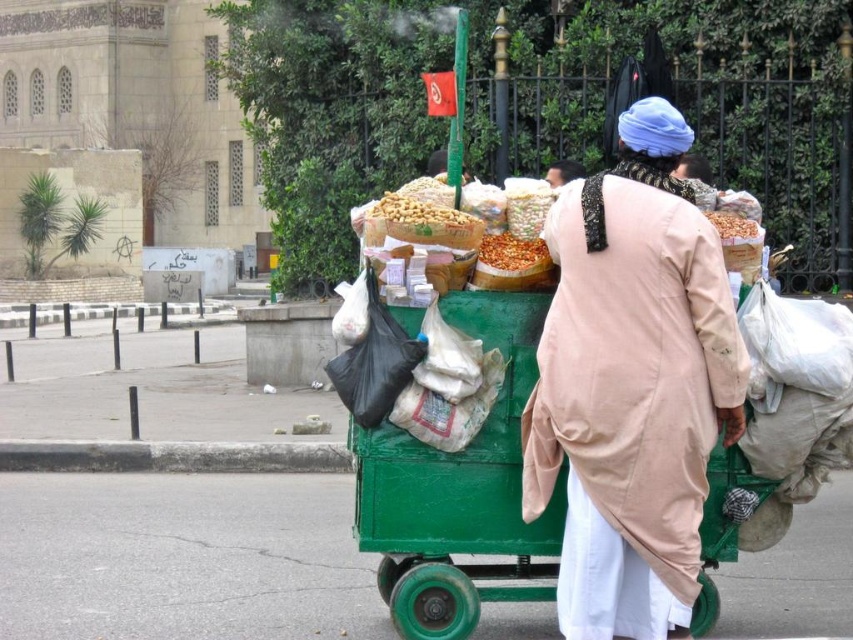
Describe the element at coordinates (419, 212) in the screenshot. I see `smooth brown nuts at center` at that location.

Does smooth brown nuts at center have a smaller size compared to beige cotton turban at upper center?

Correct, smooth brown nuts at center occupies less space than beige cotton turban at upper center.

Identify the location of smooth brown nuts at center. The image size is (853, 640). (419, 212).

Who is higher up, beige cotton robe at center or crumbly brown snack at center?

crumbly brown snack at center is above.

Can you confirm if beige cotton robe at center is positioned below crumbly brown snack at center?

Yes, beige cotton robe at center is below crumbly brown snack at center.

Image resolution: width=853 pixels, height=640 pixels. What are the coordinates of `beige cotton robe at center` in the screenshot? It's located at (631, 397).

Can you confirm if beige cotton robe at center is positioned below beige cotton turban at upper center?

Yes.

Does beige cotton robe at center have a greater height compared to beige cotton turban at upper center?

Yes.

Does point (666, 230) come in front of point (560, 170)?

Yes, point (666, 230) is closer to viewer.

Identify the location of beige cotton robe at center. The image size is (853, 640). point(631,397).